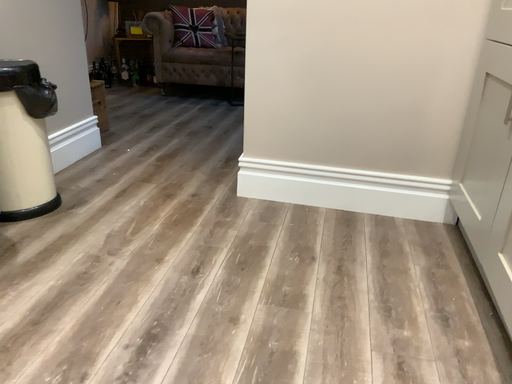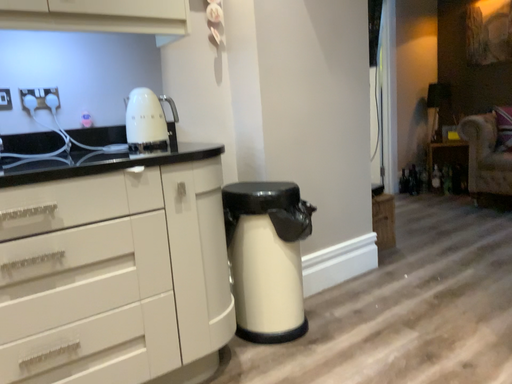
Question: Which way did the camera rotate in the video?

Choices:
 (A) rotated left
 (B) rotated right

Answer: (A)